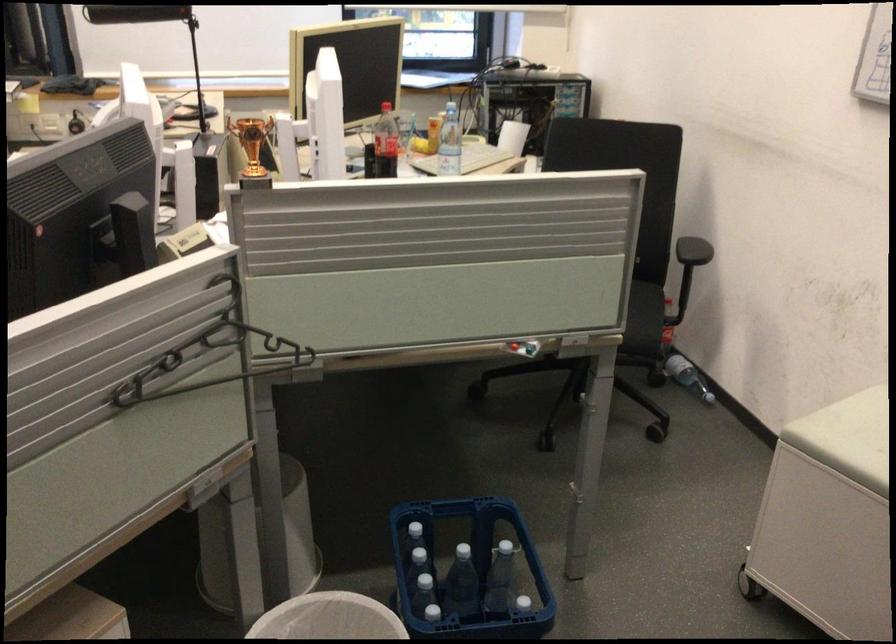
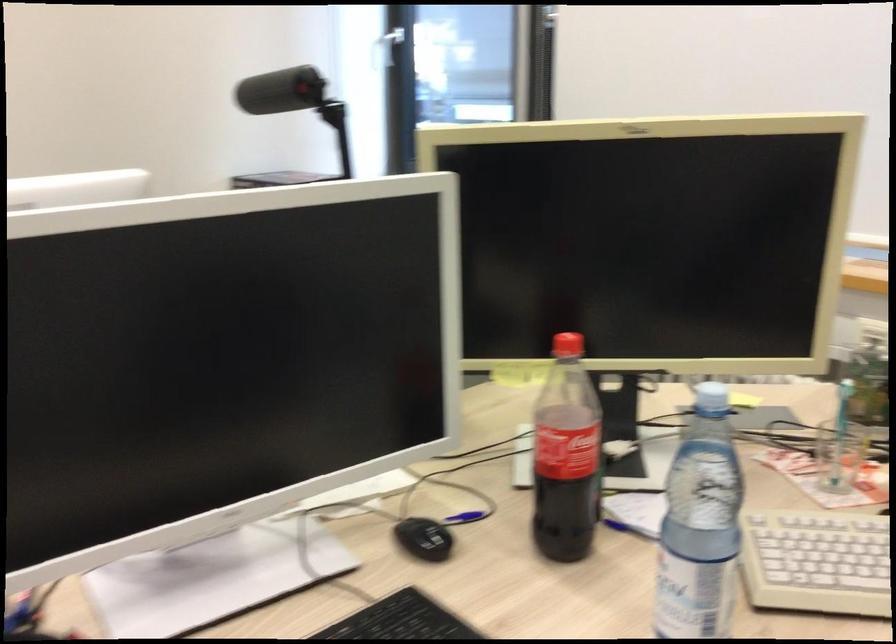
Where in the second image is the point corresponding to point 382,145 from the first image?

(565, 456)